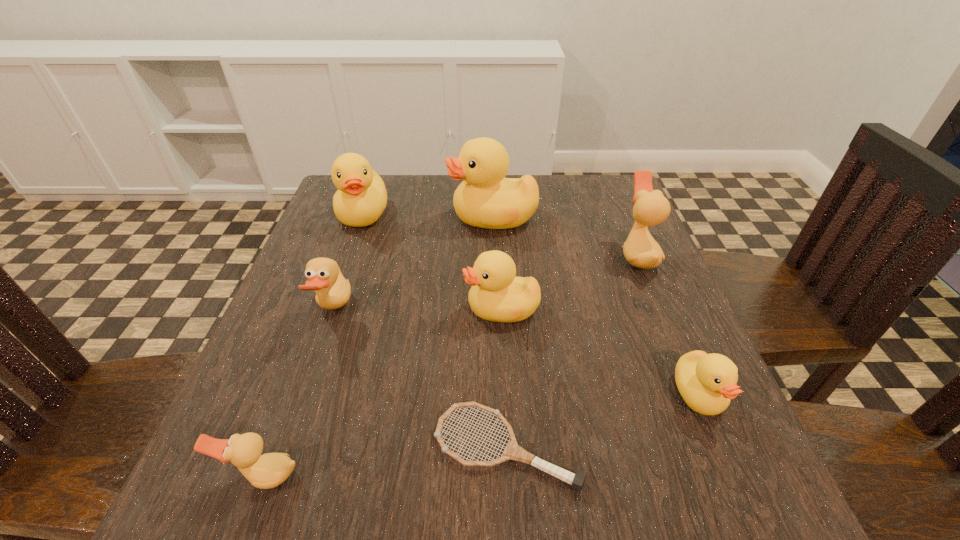
This screenshot has width=960, height=540. I want to click on free space at the near edge, so click(x=539, y=489).

Where is `vacant area at the left edge of the desktop`? This screenshot has height=540, width=960. vacant area at the left edge of the desktop is located at coordinates (269, 398).

Where is `free space at the right edge of the desktop`? This screenshot has width=960, height=540. free space at the right edge of the desktop is located at coordinates (669, 389).

Where is `vacant space at the far right corner of the desktop`? Image resolution: width=960 pixels, height=540 pixels. vacant space at the far right corner of the desktop is located at coordinates (611, 198).

Locate an element on the screen. free space between the leftmost yellow duck and the smallest tan duck is located at coordinates (313, 345).

You are a GUI agent. You are given a task and a screenshot of the screen. Output one action in this format:
    pyautogui.click(x=<x>, y=<y>)
    Task: Click on the free space between the second nearest tan duck and the second nearest duck
    This screenshot has height=540, width=960.
    Given the screenshot: What is the action you would take?
    pyautogui.click(x=516, y=352)

Find the location of a particular element. free spot between the second biggest tan duck and the nearest tan duck is located at coordinates (299, 393).

Locate an element on the screen. The width and height of the screenshot is (960, 540). vacant area that lies between the biggest tan duck and the tallest duck is located at coordinates (564, 237).

Where is `free space between the third biggest yellow duck and the gray tennis racket`? This screenshot has height=540, width=960. free space between the third biggest yellow duck and the gray tennis racket is located at coordinates click(503, 378).

Where is `vacant point located between the tallest duck and the nearest duck`? vacant point located between the tallest duck and the nearest duck is located at coordinates (378, 347).